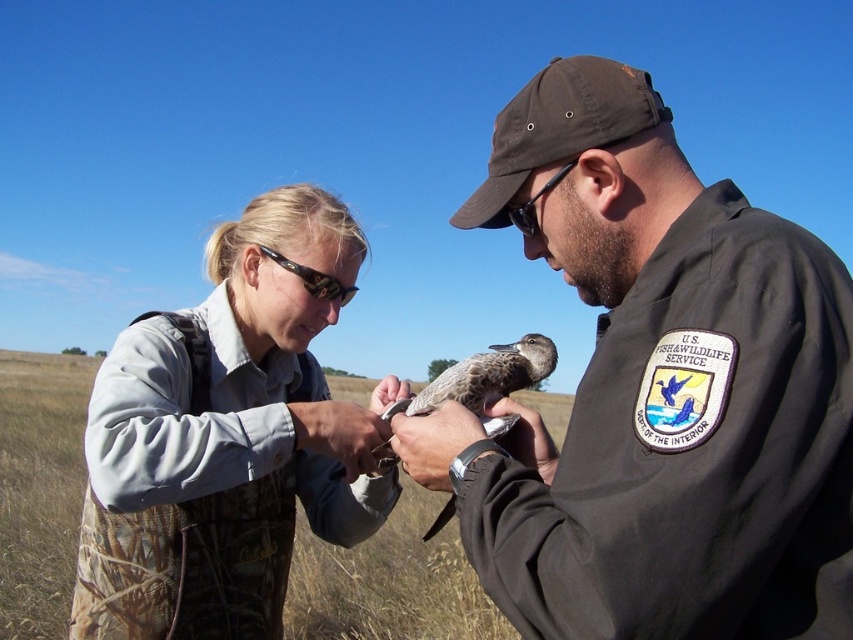
Question: Estimate the real-world distances between objects in this image. Which object is farther from the black plastic goggles at center?

Choices:
 (A) camo-patterned waders at center
 (B) tortoiseshell plastic goggles at upper center

Answer: (A)

Question: Does brown uniform at center come behind camo-patterned waders at center?

Choices:
 (A) yes
 (B) no

Answer: (B)

Question: Which of the following is the closest to the observer?

Choices:
 (A) (334, 243)
 (B) (451, 365)
 (C) (544, 193)
 (D) (314, 292)

Answer: (C)

Question: Does speckled feathered duckling at center appear on the left side of tortoiseshell plastic goggles at upper center?

Choices:
 (A) yes
 (B) no

Answer: (B)

Question: Is camo-patterned waders at center to the left of speckled feathered duckling at center from the viewer's perspective?

Choices:
 (A) no
 (B) yes

Answer: (B)

Question: Which of these objects is positioned farthest from the black plastic goggles at center?

Choices:
 (A) tortoiseshell plastic goggles at upper center
 (B) camo-patterned waders at center
 (C) speckled feathered duckling at center

Answer: (B)